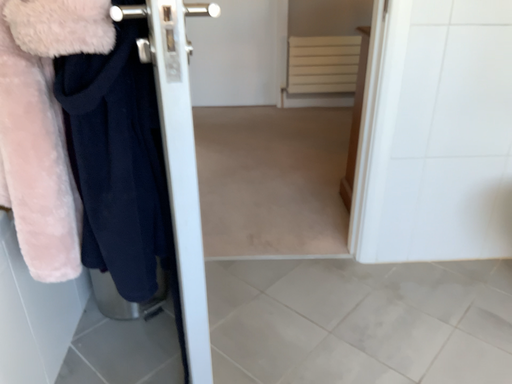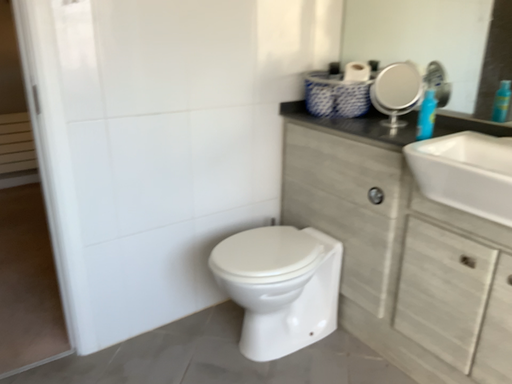
Question: How did the camera likely rotate when shooting the video?

Choices:
 (A) rotated left
 (B) rotated right

Answer: (B)